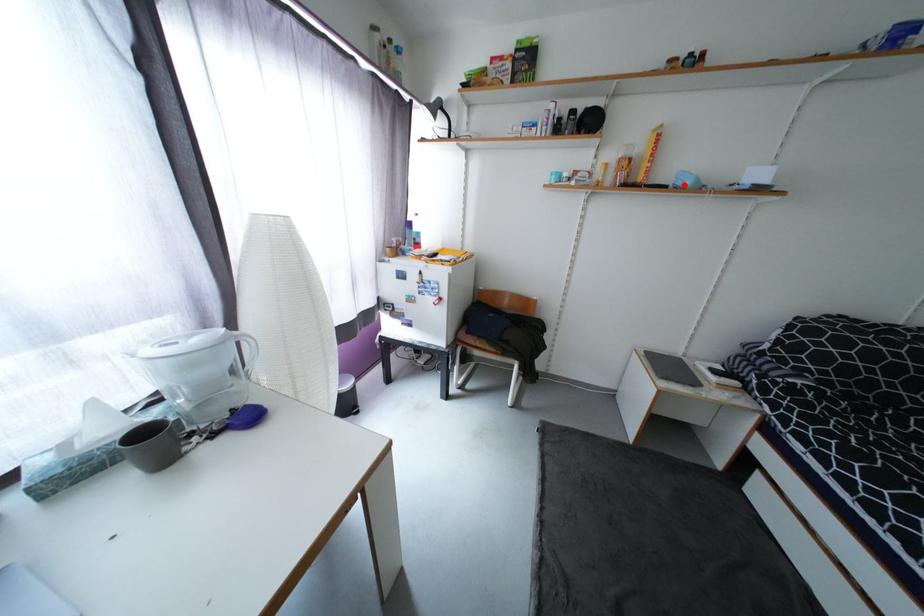
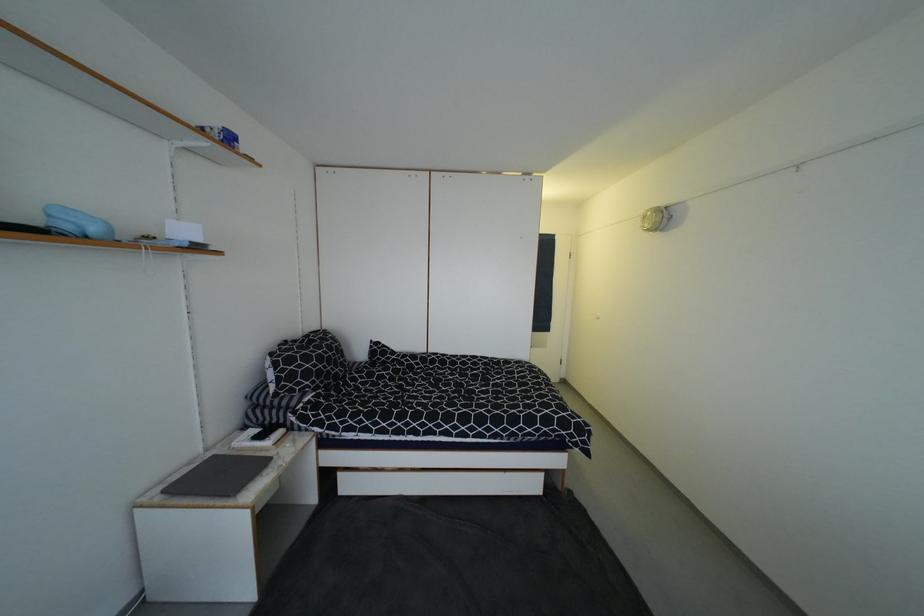
The point at the highlighted location is marked in the first image. Where is the corresponding point in the second image?

(71, 228)